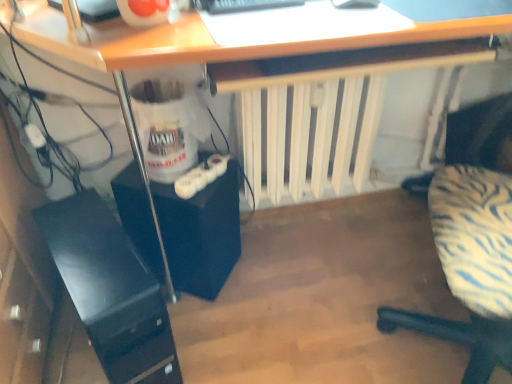
Question: Does black matte computer tower at lower left, the 1th computer tower viewed from the right, appear on the left side of black glossy computer tower at lower left, which is the second computer tower from right to left?

Choices:
 (A) yes
 (B) no

Answer: (B)

Question: From the image's perspective, does black matte computer tower at lower left, the second computer tower in the left-to-right sequence, appear higher than black glossy computer tower at lower left, which is the second computer tower from right to left?

Choices:
 (A) yes
 (B) no

Answer: (A)

Question: Can you confirm if black matte computer tower at lower left, the 1th computer tower viewed from the right, is taller than black glossy computer tower at lower left, which is the second computer tower from right to left?

Choices:
 (A) no
 (B) yes

Answer: (A)

Question: Is black matte computer tower at lower left, the 1th computer tower viewed from the right, shorter than black glossy computer tower at lower left, which is the second computer tower from right to left?

Choices:
 (A) yes
 (B) no

Answer: (A)

Question: Is black matte computer tower at lower left, the 1th computer tower viewed from the right, behind black glossy computer tower at lower left, which is the second computer tower from right to left?

Choices:
 (A) yes
 (B) no

Answer: (A)

Question: In terms of width, does black glossy computer tower at lower left, which is the first computer tower in left-to-right order, look wider or thinner when compared to white matte radiator at center?

Choices:
 (A) thin
 (B) wide

Answer: (B)

Question: Based on their sizes in the image, would you say black glossy computer tower at lower left, which is the second computer tower from right to left, is bigger or smaller than white matte radiator at center?

Choices:
 (A) big
 (B) small

Answer: (B)

Question: Is black glossy computer tower at lower left, which is the first computer tower in left-to-right order, to the left or to the right of white matte radiator at center in the image?

Choices:
 (A) left
 (B) right

Answer: (A)

Question: From the image's perspective, relative to white matte radiator at center, is black glossy computer tower at lower left, which is the first computer tower in left-to-right order, above or below?

Choices:
 (A) above
 (B) below

Answer: (B)

Question: In the image, is zebra-patterned fabric chair at right positioned in front of or behind black matte computer tower at lower left, the 1th computer tower viewed from the right?

Choices:
 (A) front
 (B) behind

Answer: (A)

Question: From a real-world perspective, is zebra-patterned fabric chair at right positioned above or below black matte computer tower at lower left, the second computer tower in the left-to-right sequence?

Choices:
 (A) above
 (B) below

Answer: (A)

Question: From the image's perspective, is zebra-patterned fabric chair at right positioned above or below black matte computer tower at lower left, the second computer tower in the left-to-right sequence?

Choices:
 (A) above
 (B) below

Answer: (A)

Question: In terms of width, does zebra-patterned fabric chair at right look wider or thinner when compared to black matte computer tower at lower left, the second computer tower in the left-to-right sequence?

Choices:
 (A) wide
 (B) thin

Answer: (A)

Question: Choose the correct answer: Is zebra-patterned fabric chair at right inside white matte radiator at center or outside it?

Choices:
 (A) outside
 (B) inside

Answer: (A)

Question: In terms of height, does zebra-patterned fabric chair at right look taller or shorter compared to white matte radiator at center?

Choices:
 (A) tall
 (B) short

Answer: (A)